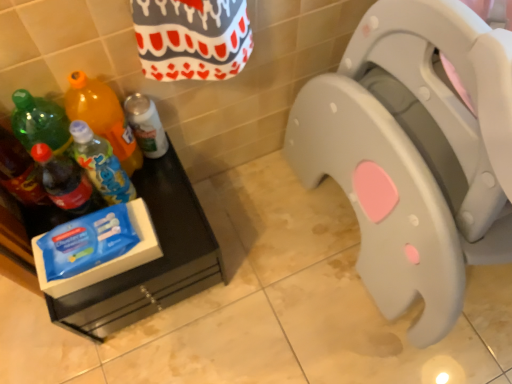
This screenshot has height=384, width=512. Find the location of `free location to the right of translucent plastic soda bottle at left, which is the second bottle from left to right`. free location to the right of translucent plastic soda bottle at left, which is the second bottle from left to right is located at coordinates (170, 215).